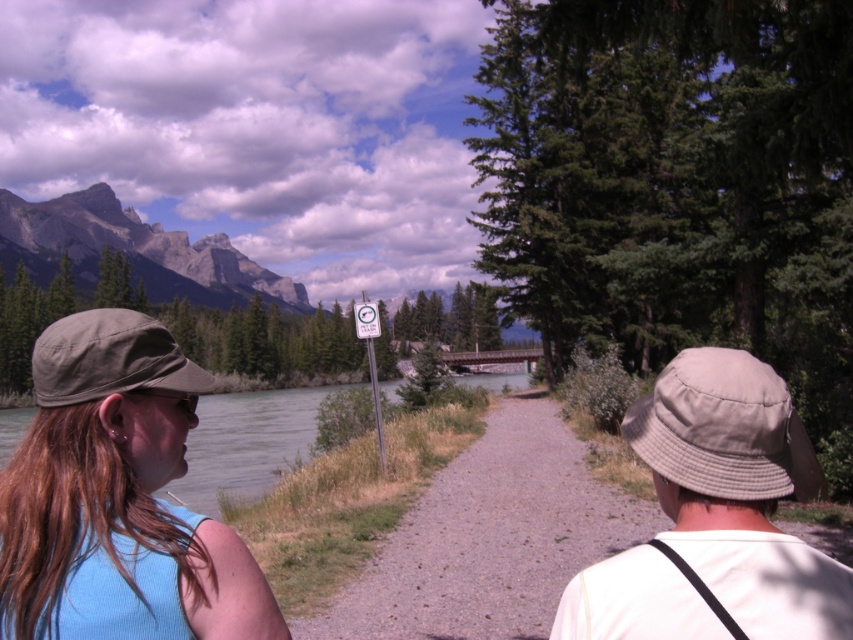
You are standing at the starting point of the path and want to reach the point marked by point [177,403] and point [578,636]. Which point should you reach first?

You should reach point [578,636] first because point [177,403] is behind it.

You are a photographer standing on the gravel path at center. You want to take a photo of the matte blue tank top at left. Which direction should you face to ensure the subject is centered in your frame?

The matte blue tank top at left is positioned over the gravel path at center, so you should face towards the left to center the matte blue tank top at left in your frame.